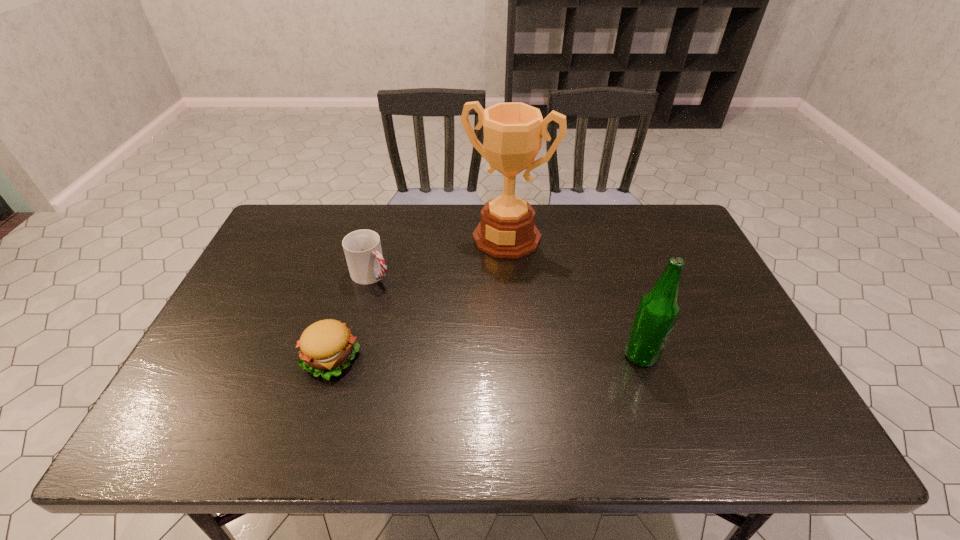
Where is `free region located 0.320m on the handle side of the cup`? This screenshot has height=540, width=960. free region located 0.320m on the handle side of the cup is located at coordinates (468, 342).

Locate an element on the screen. This screenshot has height=540, width=960. vacant region located on the handle side of the cup is located at coordinates (450, 330).

Where is `vacant space located on the front-facing side of the third object from left to right`? The image size is (960, 540). vacant space located on the front-facing side of the third object from left to right is located at coordinates coord(461,316).

The width and height of the screenshot is (960, 540). I want to click on vacant space situated 0.280m on the front-facing side of the third object from left to right, so click(458, 321).

At what (x,y) coordinates should I click in order to perform the action: click on vacant space located on the front-facing side of the third object from left to right. Please return your answer as a coordinate pair (x, y). The image size is (960, 540). Looking at the image, I should click on (481, 278).

This screenshot has width=960, height=540. I want to click on object positioned at the far edge, so tap(513, 132).

Where is `object located at the near edge`? The height and width of the screenshot is (540, 960). object located at the near edge is located at coordinates (327, 346).

What are the coordinates of `vacant area at the far edge` in the screenshot? It's located at [x=434, y=248].

Find the location of a particular element. The width and height of the screenshot is (960, 540). free region at the near edge is located at coordinates (444, 408).

Identify the location of blank space at the left edge of the desktop. (246, 326).